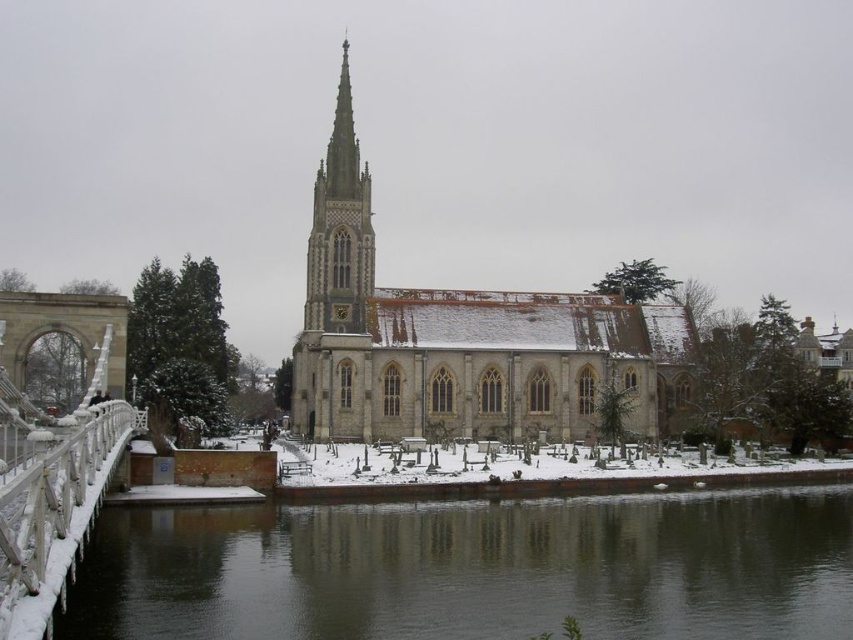
Question: Which point is farther to the camera?

Choices:
 (A) (0, 486)
 (B) (315, 220)
 (C) (335, 218)

Answer: (B)

Question: Estimate the real-world distances between objects in this image. Which object is closer to the stone church at center?

Choices:
 (A) white frosted bridge at left
 (B) white stone spire at center
 (C) black ice at lower left

Answer: (B)

Question: Can you confirm if black ice at lower left is positioned below white stone spire at center?

Choices:
 (A) no
 (B) yes

Answer: (B)

Question: Can you confirm if black ice at lower left is positioned to the left of white stone spire at center?

Choices:
 (A) no
 (B) yes

Answer: (A)

Question: Which object appears farthest from the camera in this image?

Choices:
 (A) white stone spire at center
 (B) black ice at lower left
 (C) stone church at center
 (D) white frosted bridge at left

Answer: (A)

Question: Is stone church at center to the left of white stone spire at center from the viewer's perspective?

Choices:
 (A) no
 (B) yes

Answer: (A)